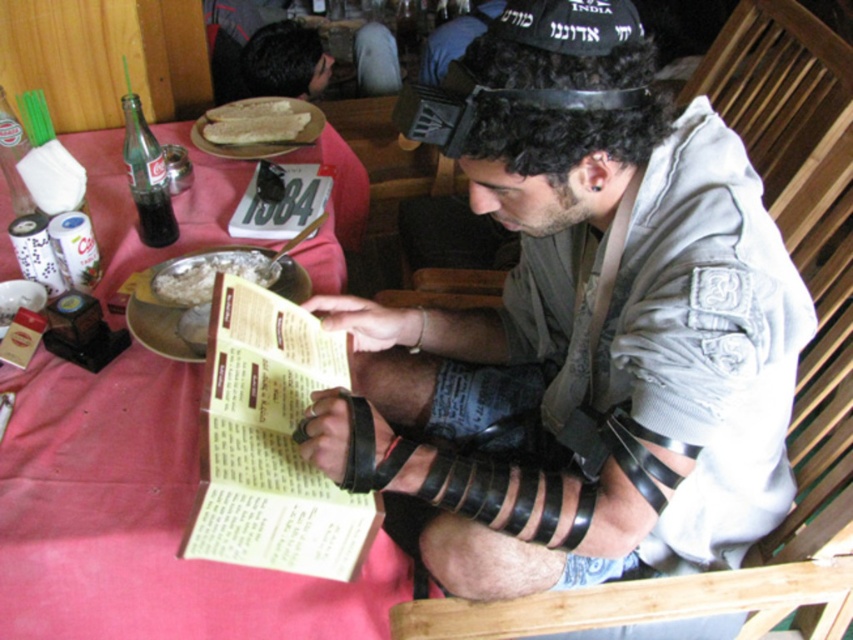
You are a waiter in a restaurant and need to place a 10 inch long decorative ribbon between the pink fabric table at center and the white rice at center. Is there enough space to place the ribbon without overlapping either item?

The pink fabric table at center is 9.82 inches away from white rice at center. Since the ribbon is 10 inches long, there isn not enough space to place the ribbon between them without overlapping either item.